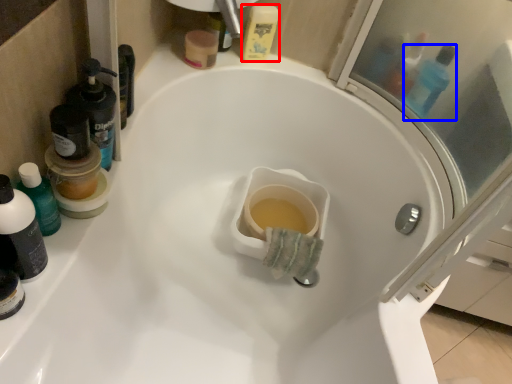
Question: Which object appears closest to the camera in this image, mouthwash (highlighted by a red box) or mouthwash (highlighted by a blue box)?

Choices:
 (A) mouthwash
 (B) mouthwash

Answer: (B)